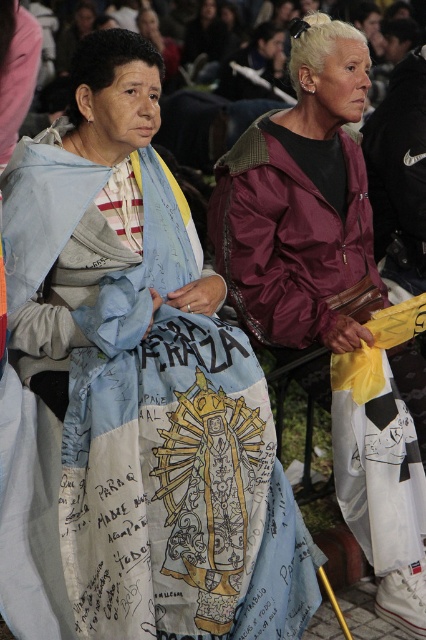
You are standing in front of the two people in the image. Which of the two points, point (141, 564) or point (396, 596), is closer to you?

Point (141, 564) is closer to you than point (396, 596).

You are an artist trying to sketch the scene. You need to decide which object to draw first based on their sizes. Which one should you start with, the blue fabric shawl at left or the maroon nylon jacket at center?

The blue fabric shawl at left has a larger size compared to maroon nylon jacket at center. Therefore, you should start with the blue fabric shawl at left as it occupies more space in the scene.